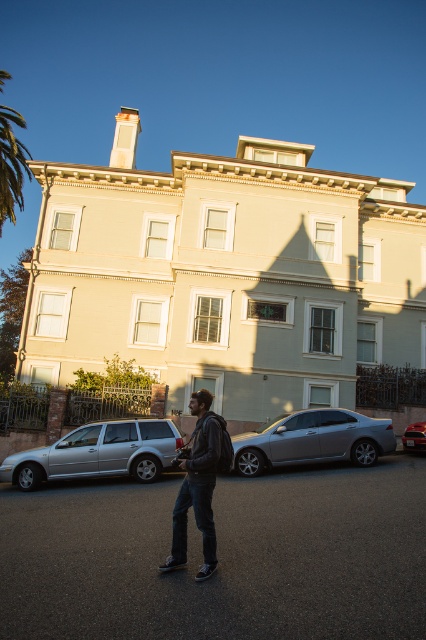
You are standing at the entrance of the two story building and see the satin silver sedan at center. If you want to walk directly towards the sedan, which direction should you head?

The satin silver sedan at center is located at point (313, 440), so you should head towards the lower right direction from the entrance to reach it.

You are a delivery person who needs to park your van next to the silver metallic station wagon at lower left and the dark gray hoodie at center. Can you park your van between them without overlapping either?

The silver metallic station wagon at lower left is larger than the dark gray hoodie at center. Since the van requires space, it might not fit between them if the distance between the two objects is too small. However, the exact positioning depends on the available space between them, which isn not specified in the provided information.